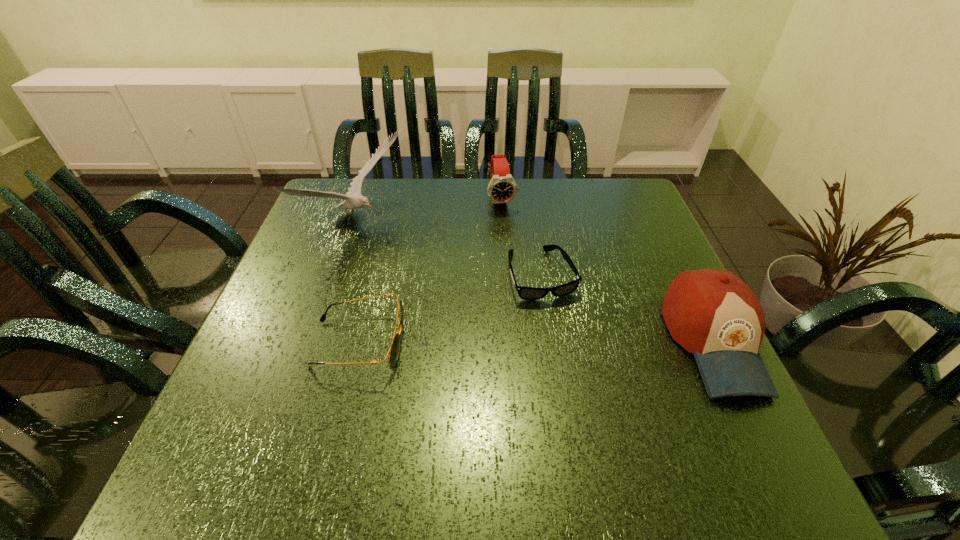
At what (x,y) coordinates should I click in order to perform the action: click on free spot between the watch and the tallest object. Please return your answer as a coordinate pair (x, y). This screenshot has height=540, width=960. Looking at the image, I should click on (429, 212).

You are a GUI agent. You are given a task and a screenshot of the screen. Output one action in this format:
    pyautogui.click(x=<x>, y=<y>)
    Task: Click on the vacant space in between the baseball cap and the right sunglasses
    
    Given the screenshot: What is the action you would take?
    pyautogui.click(x=628, y=308)

Locate which object is the closest to the watch. Please provide its 2D coordinates. Your answer should be formatted as a tuple, i.e. [(x, y)], where the tuple contains the x and y coordinates of a point satisfying the conditions above.

[(526, 293)]

Point out which object is positioned as the third nearest to the shortest object. Please provide its 2D coordinates. Your answer should be formatted as a tuple, i.e. [(x, y)], where the tuple contains the x and y coordinates of a point satisfying the conditions above.

[(394, 350)]

What are the coordinates of `blank area in the image that satisfies the following two spatial constraints: 1. on the front side of the gull; 2. on the front-facing side of the nearer sunglasses` in the screenshot? It's located at (316, 343).